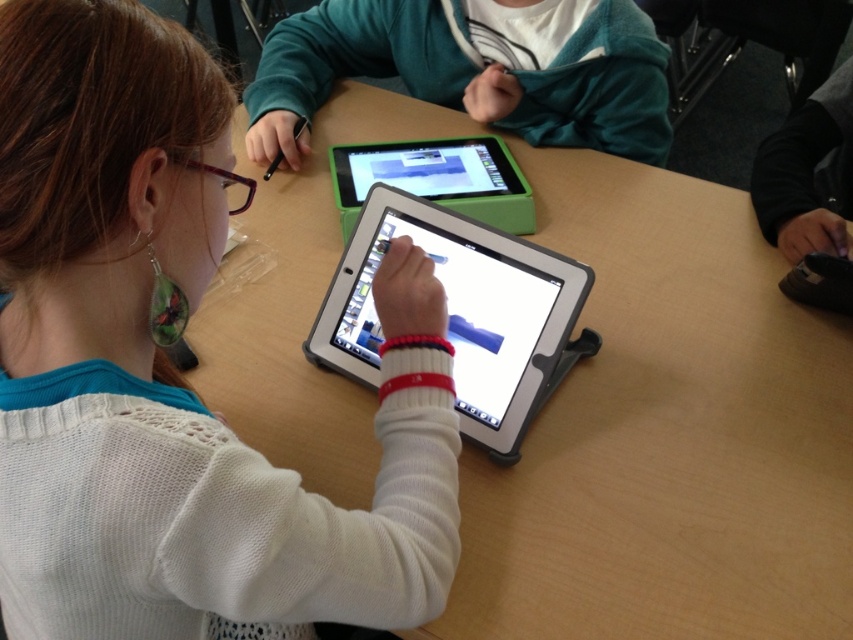
Question: Among these points, which one is nearest to the camera?

Choices:
 (A) (509, 296)
 (B) (460, 170)
 (C) (282, 60)
 (D) (219, 316)

Answer: (A)

Question: Estimate the real-world distances between objects in this image. Which object is closer to the teal fleece hoodie at upper center?

Choices:
 (A) wooden table at center
 (B) green plastic tablet at upper center
 (C) white plastic tablet at center

Answer: (B)

Question: Estimate the real-world distances between objects in this image. Which object is closer to the wooden table at center?

Choices:
 (A) white plastic tablet at center
 (B) teal fleece hoodie at upper center

Answer: (A)

Question: Can you confirm if white matte sweater at center is bigger than green plastic tablet at upper center?

Choices:
 (A) no
 (B) yes

Answer: (B)

Question: Does wooden table at center appear over white plastic tablet at center?

Choices:
 (A) no
 (B) yes

Answer: (B)

Question: Is white matte sweater at center in front of teal fleece hoodie at upper center?

Choices:
 (A) no
 (B) yes

Answer: (B)